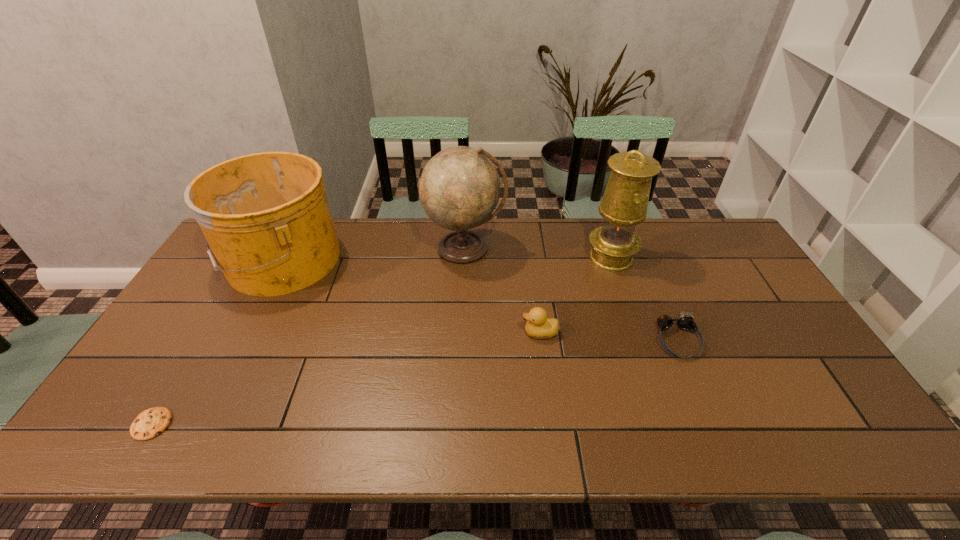
This screenshot has height=540, width=960. Identify the location of oil lamp. 624,204.

The image size is (960, 540). In order to click on globe in this screenshot , I will do `click(459, 188)`.

You are a GUI agent. You are given a task and a screenshot of the screen. Output one action in this format:
    pyautogui.click(x=<x>, y=<y>)
    Task: Click on the bucket
    
    Given the screenshot: What is the action you would take?
    pyautogui.click(x=266, y=217)

Image resolution: width=960 pixels, height=540 pixels. In order to click on the third object from right to left in this screenshot , I will do `click(539, 326)`.

This screenshot has height=540, width=960. In order to click on duckling in this screenshot , I will do `click(539, 326)`.

Identify the location of goggles. (685, 321).

Find the location of a particular element. Image resolution: width=960 pixels, height=540 pixels. the shortest object is located at coordinates (150, 423).

Identify the location of cookie. (150, 423).

Where is `vacant space located on the left of the oil lamp`? vacant space located on the left of the oil lamp is located at coordinates (523, 258).

Locate an element on the screen. This screenshot has width=960, height=540. vacant space situated on the front-facing side of the third object from left to right is located at coordinates (461, 367).